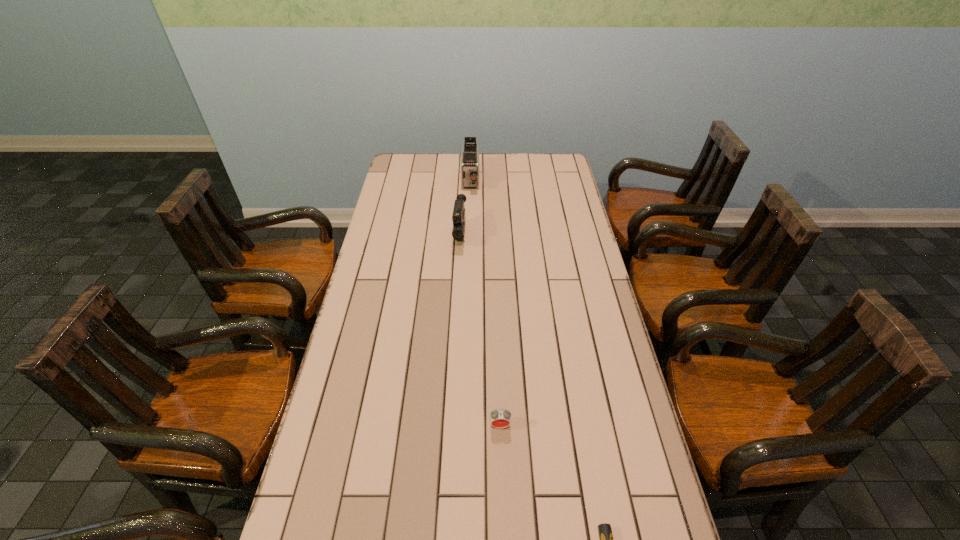
In the image, there is a desktop. Identify the location of free space at the far edge. (439, 173).

Find the location of a particular element. blank space at the left edge of the desktop is located at coordinates (344, 535).

The width and height of the screenshot is (960, 540). In the image, there is a desktop. Find the location of `vacant space at the right edge`. vacant space at the right edge is located at coordinates (553, 232).

Locate an element on the screen. The height and width of the screenshot is (540, 960). free space at the far left corner of the desktop is located at coordinates (391, 177).

The height and width of the screenshot is (540, 960). Identify the location of free point between the farther camcorder and the alarm clock. (485, 303).

At what (x,y) coordinates should I click in order to perform the action: click on free space between the shorter camcorder and the alarm clock. Please return your answer as a coordinate pair (x, y). Looking at the image, I should click on (480, 330).

Image resolution: width=960 pixels, height=540 pixels. In order to click on free area in between the third farthest object and the second tallest object in this screenshot , I will do `click(480, 330)`.

Locate an element on the screen. free area in between the tallest object and the third object from left to right is located at coordinates coord(485,303).

Locate an element on the screen. empty space that is in between the shorter camcorder and the third object from left to right is located at coordinates (480, 330).

Select which object appears as the third closest to the third farthest object. Please provide its 2D coordinates. Your answer should be formatted as a tuple, i.e. [(x, y)], where the tuple contains the x and y coordinates of a point satisfying the conditions above.

[(470, 150)]